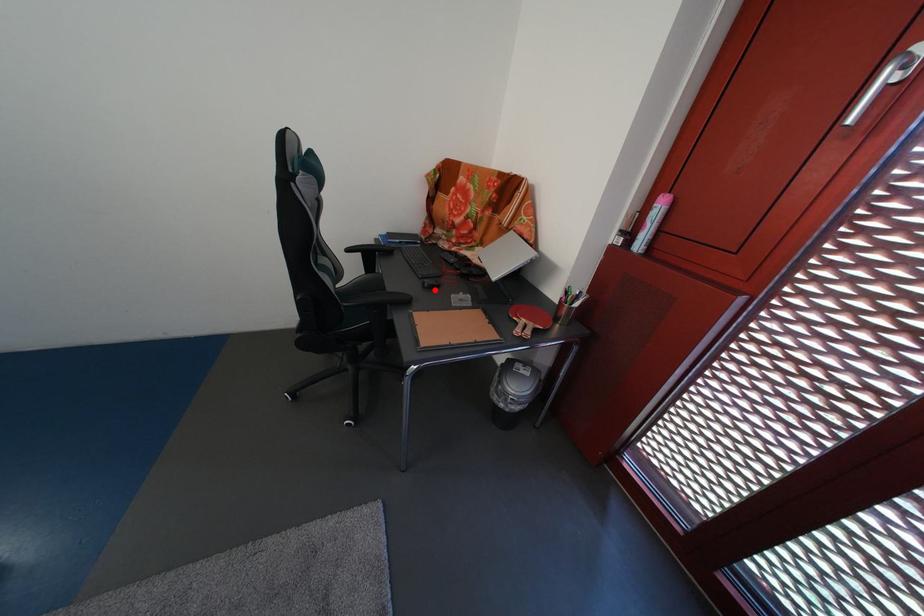
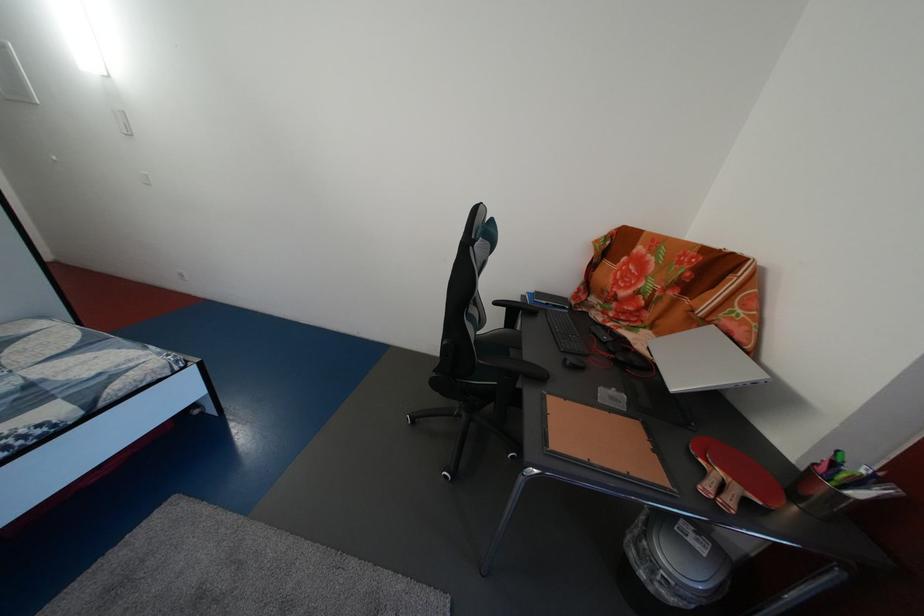
Locate, in the second image, the point that corresponds to the highlighted location in the first image.

(576, 367)